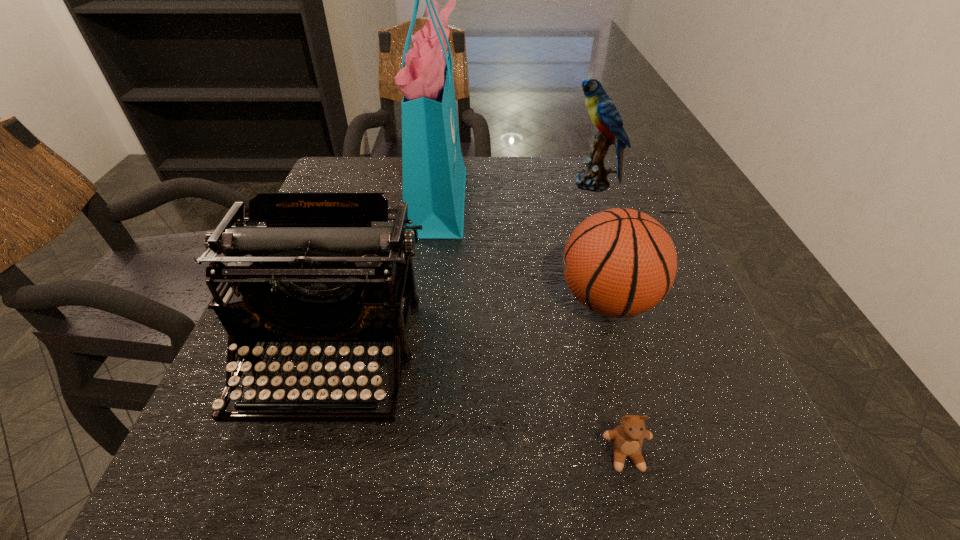
This screenshot has height=540, width=960. Find the location of `the tallest object`. the tallest object is located at coordinates (433, 172).

Where is `parrot`? This screenshot has width=960, height=540. parrot is located at coordinates (604, 115).

You are a GUI agent. You are given a task and a screenshot of the screen. Output one action in this format:
    pyautogui.click(x=<x>, y=<y>)
    Task: Click on the typewriter
    
    Given the screenshot: What is the action you would take?
    pyautogui.click(x=318, y=271)

The image size is (960, 540). Identify the location of basketball. (620, 262).

Locate an element on the screen. The height and width of the screenshot is (540, 960). the nearest object is located at coordinates (626, 439).

This screenshot has height=540, width=960. I want to click on the shortest object, so click(x=626, y=439).

The image size is (960, 540). Identify the location of vacant space located on the right of the shopping bag. (505, 197).

Image resolution: width=960 pixels, height=540 pixels. Find the location of `free space located 0.260m on the face of the parrot`. free space located 0.260m on the face of the parrot is located at coordinates (468, 184).

Where is `vacant space situated on the face of the parrot`? The image size is (960, 540). vacant space situated on the face of the parrot is located at coordinates (492, 184).

Locate an element on the screen. The height and width of the screenshot is (540, 960). free point located 0.160m on the face of the parrot is located at coordinates (507, 184).